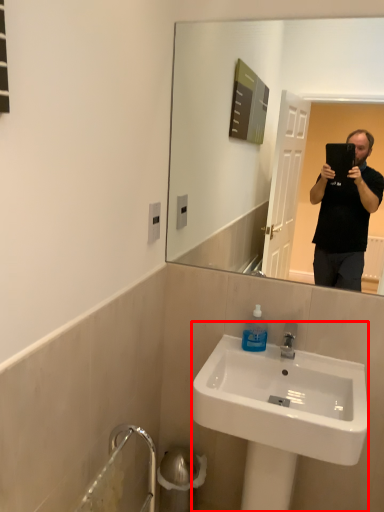
Question: Considering the relative positions of sink (annotated by the red box) and bottle in the image provided, where is sink (annotated by the red box) located with respect to the staircase?

Choices:
 (A) left
 (B) right

Answer: (B)